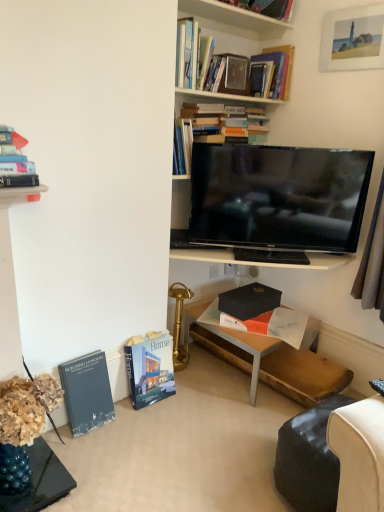
This screenshot has width=384, height=512. In order to click on vacant space situated above black matte box at center, which appears as the 3th book when ordered from the bottom (from a real-world perspective) in this screenshot , I will do `click(252, 289)`.